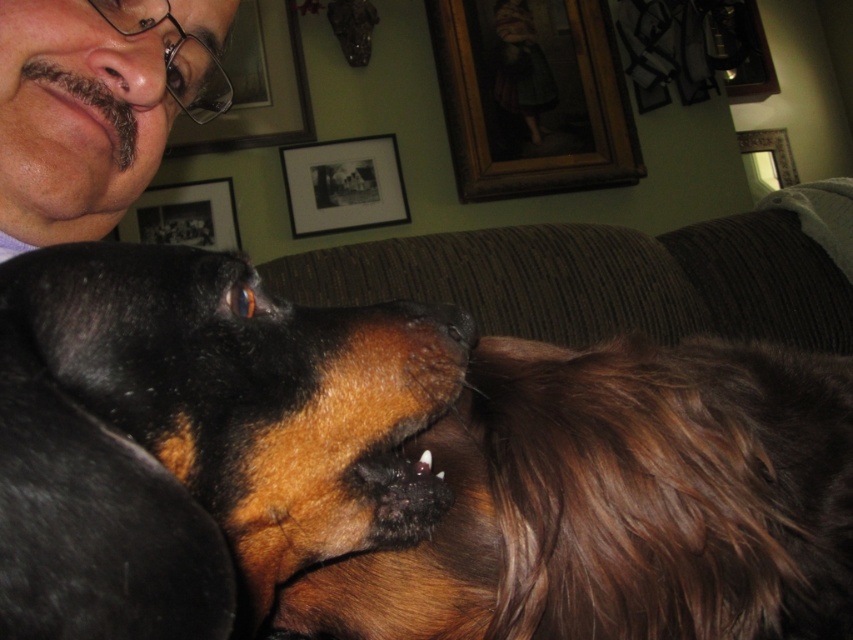
You are an interior designer assessing the wall space in this living room. You see the wooden frame at upper center and the matte glass picture frame at upper left. Which one has a greater width?

The wooden frame at upper center has a greater width than the matte glass picture frame at upper left.

You are a photographer trying to capture a photo of the brown fuzzy dog at center and the wooden frame at upper center. You want to ensure both are in the frame. Based on their positions, which object is closer to the left edge of the photo?

The brown fuzzy dog at center is positioned on the left side of the wooden frame at upper center, so it is closer to the left edge of the photo.